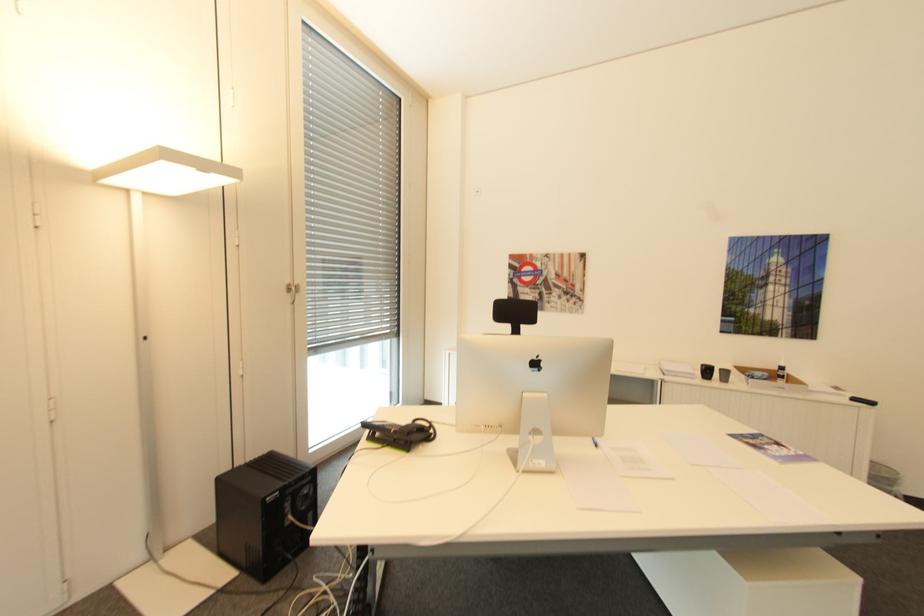
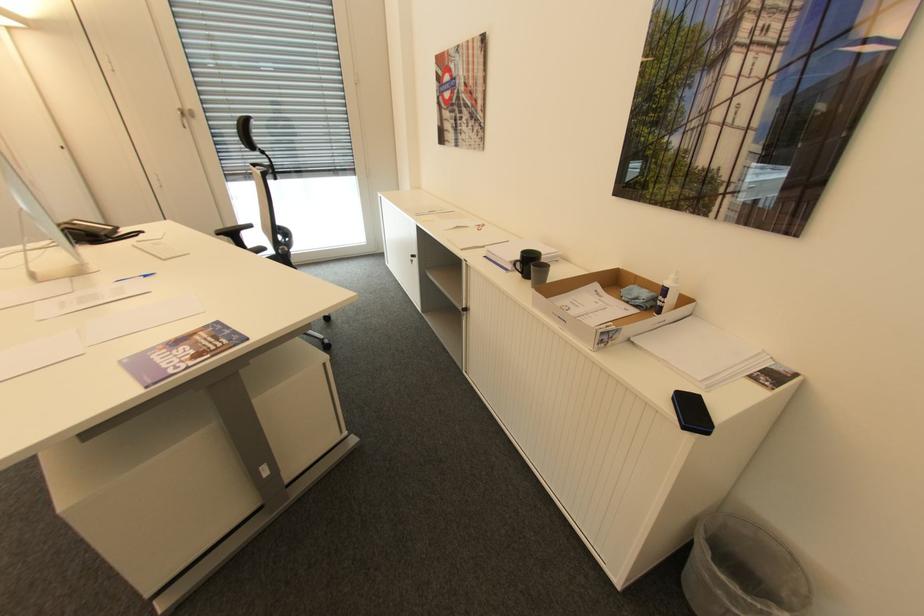
In the second image, find the point that corresponds to pixel 730 371 in the first image.

(550, 268)